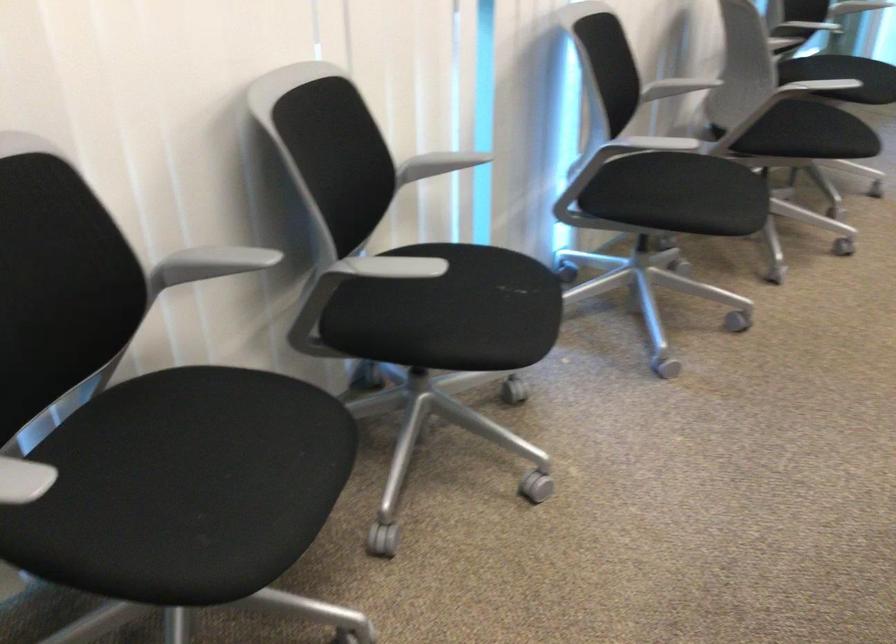
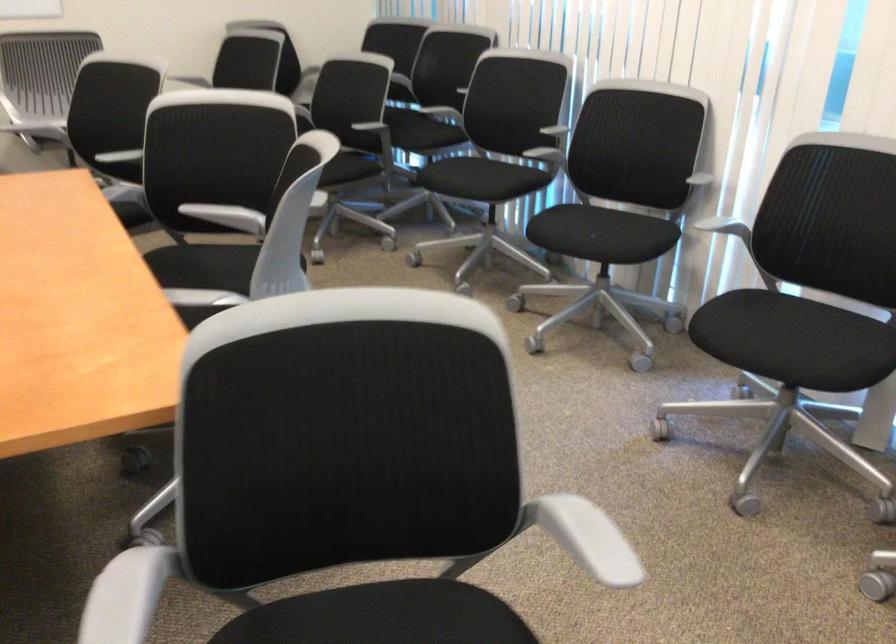
Find the pixel in the second image that matches the point at 501,295 in the first image.

(582, 232)